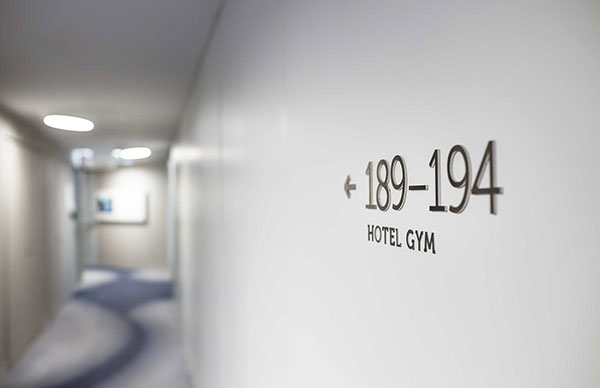
Where is `blue swirl on floor`? blue swirl on floor is located at coordinates coord(135,342).